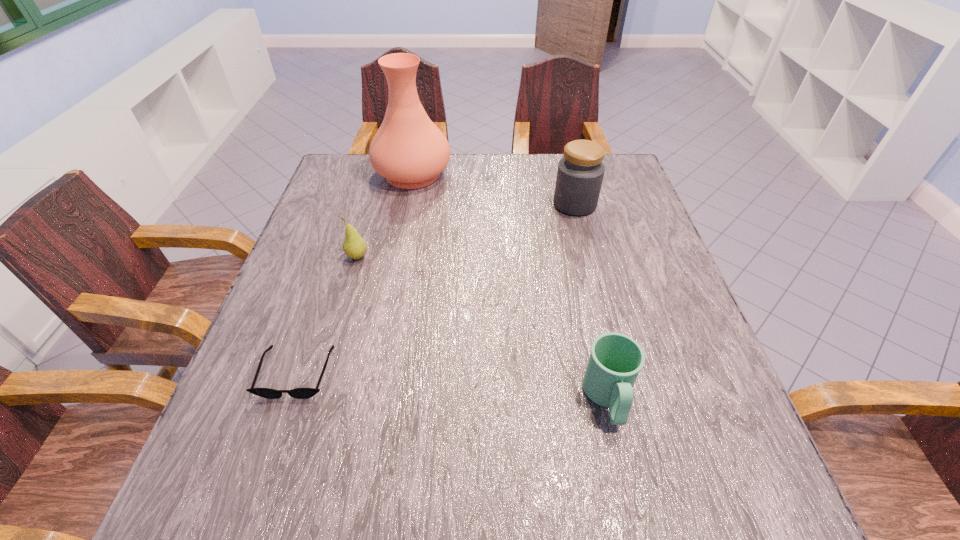
I want to click on free space at the far edge of the desktop, so click(528, 162).

The image size is (960, 540). Find the location of `free space at the near edge of the desktop`. free space at the near edge of the desktop is located at coordinates (543, 468).

Locate an element on the screen. This screenshot has height=540, width=960. vacant space at the left edge of the desktop is located at coordinates (332, 210).

Locate an element on the screen. free region at the right edge of the desktop is located at coordinates (653, 271).

I want to click on blank space at the far left corner of the desktop, so click(350, 183).

What are the coordinates of `vacant region at the near left corner of the desktop` in the screenshot? It's located at (211, 468).

What are the coordinates of `free region at the far right corner` in the screenshot? It's located at (611, 154).

In the image, there is a desktop. Where is `free space at the near right corner`? free space at the near right corner is located at coordinates (708, 471).

Locate an element on the screen. This screenshot has height=540, width=960. unoccupied position between the mug and the shortest object is located at coordinates (452, 386).

At what (x,y) coordinates should I click in order to perform the action: click on vacant space that is in between the pear and the shortest object. Please return your answer as a coordinate pair (x, y). This screenshot has height=540, width=960. Looking at the image, I should click on (327, 315).